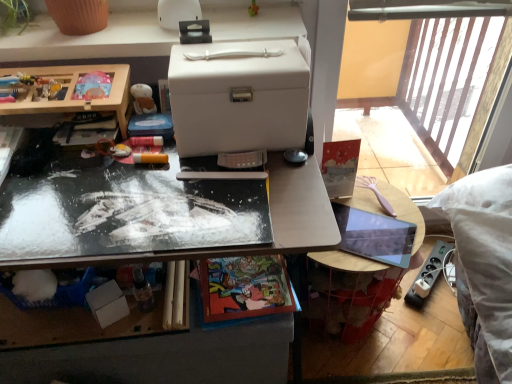
Question: Is metallic reflective desk at center, which is counted as the first desk, starting from the bottom, shorter than smooth wooden table at right?

Choices:
 (A) yes
 (B) no

Answer: (B)

Question: From the image's perspective, does metallic reflective desk at center, which is counted as the first desk, starting from the bottom, appear lower than smooth wooden table at right?

Choices:
 (A) yes
 (B) no

Answer: (A)

Question: Is metallic reflective desk at center, which appears as the 3th desk when viewed from the top, further to the viewer compared to smooth wooden table at right?

Choices:
 (A) yes
 (B) no

Answer: (B)

Question: Can you confirm if metallic reflective desk at center, which appears as the 3th desk when viewed from the top, is wider than smooth wooden table at right?

Choices:
 (A) no
 (B) yes

Answer: (B)

Question: From the image's perspective, is metallic reflective desk at center, which is counted as the first desk, starting from the bottom, located above smooth wooden table at right?

Choices:
 (A) yes
 (B) no

Answer: (B)

Question: From a real-world perspective, relative to white plastic storage box at upper center, the first desk viewed from the top, is wooden toy box at left, which is counted as the 2th desk, starting from the bottom, vertically above or below?

Choices:
 (A) above
 (B) below

Answer: (B)

Question: Considering the positions of point (126, 66) and point (165, 54), is point (126, 66) closer or farther from the camera than point (165, 54)?

Choices:
 (A) farther
 (B) closer

Answer: (B)

Question: From the image's perspective, is wooden toy box at left, the 2th desk positioned from the top, located above or below white plastic storage box at upper center, placed as the third desk when sorted from bottom to top?

Choices:
 (A) below
 (B) above

Answer: (A)

Question: Is wooden toy box at left, the 2th desk positioned from the top, taller or shorter than white plastic storage box at upper center, placed as the third desk when sorted from bottom to top?

Choices:
 (A) tall
 (B) short

Answer: (A)

Question: Considering the positions of smooth wooden table at right and wooden toy box at left, the 2th desk positioned from the top, in the image, is smooth wooden table at right taller or shorter than wooden toy box at left, the 2th desk positioned from the top,?

Choices:
 (A) short
 (B) tall

Answer: (A)

Question: Would you say smooth wooden table at right is to the left or to the right of wooden toy box at left, which is counted as the 2th desk, starting from the bottom, in the picture?

Choices:
 (A) right
 (B) left

Answer: (A)

Question: From a real-world perspective, is smooth wooden table at right above or below wooden toy box at left, which is counted as the 2th desk, starting from the bottom?

Choices:
 (A) above
 (B) below

Answer: (B)

Question: Is smooth wooden table at right bigger or smaller than wooden toy box at left, the 2th desk positioned from the top?

Choices:
 (A) big
 (B) small

Answer: (B)

Question: Is metallic reflective desk at center, which is counted as the first desk, starting from the bottom, spatially inside wooden toy box at left, which is counted as the 2th desk, starting from the bottom, or outside of it?

Choices:
 (A) outside
 (B) inside

Answer: (A)

Question: In the image, is metallic reflective desk at center, which appears as the 3th desk when viewed from the top, on the left side or the right side of wooden toy box at left, the 2th desk positioned from the top?

Choices:
 (A) left
 (B) right

Answer: (B)